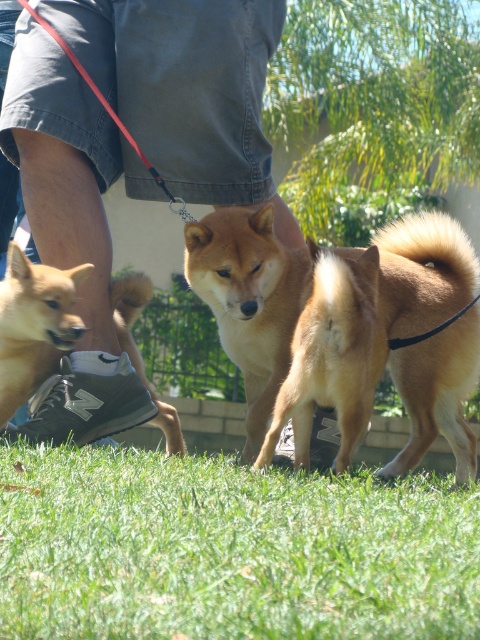
Question: Which object is positioned closest to the golden fur dog at center?

Choices:
 (A) golden fur dog at lower left
 (B) gray denim shorts at lower left
 (C) green grass at lower center

Answer: (B)

Question: Which point is closer to the camera taking this photo?

Choices:
 (A) (160, 504)
 (B) (94, 381)
 (C) (121, 344)

Answer: (A)

Question: Does green grass at lower center have a larger size compared to gray denim shorts at lower left?

Choices:
 (A) no
 (B) yes

Answer: (A)

Question: Is golden fur dog at center bigger than golden fur dog at lower left?

Choices:
 (A) yes
 (B) no

Answer: (A)

Question: Is gray denim shorts at lower left thinner than golden fur dog at lower left?

Choices:
 (A) yes
 (B) no

Answer: (B)

Question: Which point is closer to the camera taking this photo?

Choices:
 (A) (276, 198)
 (B) (49, 266)

Answer: (B)